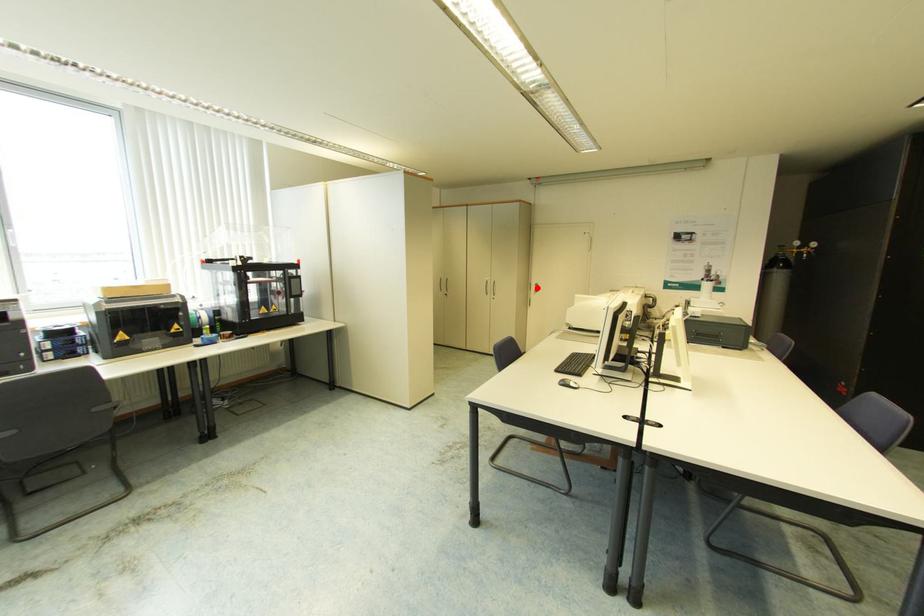
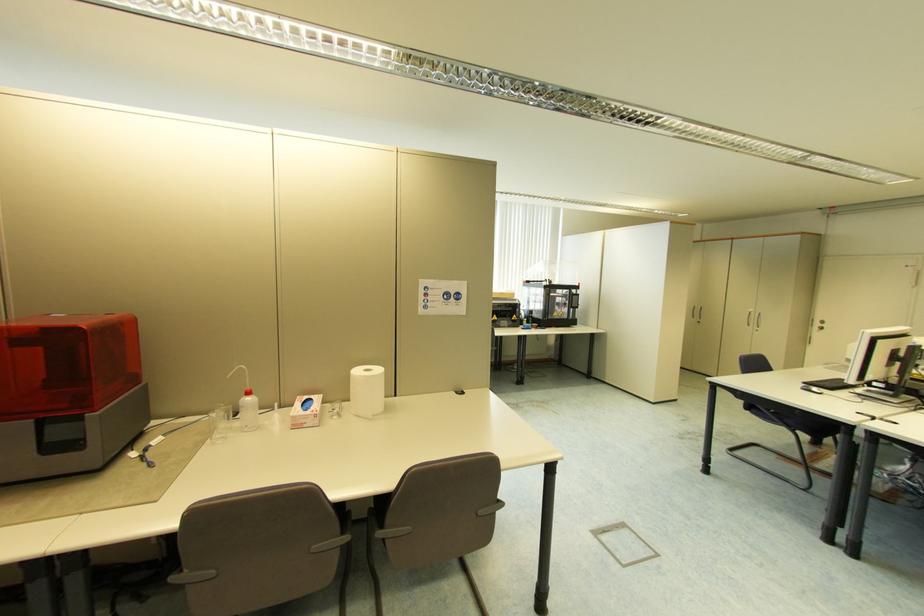
The point at the highlighted location is marked in the first image. Where is the corresponding point in the second image?

(821, 325)